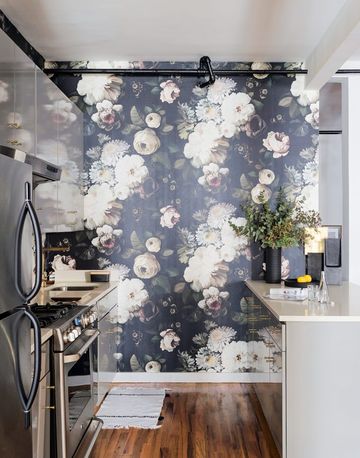
Identify the location of counter top. This screenshot has height=458, width=360. (307, 311).